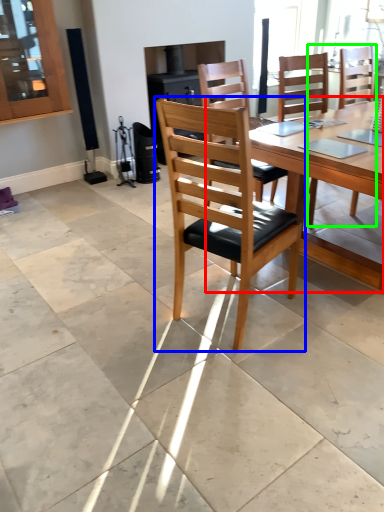
Question: Which object is positioned closest to round table (highlighted by a red box)? Select from chair (highlighted by a blue box) and chair (highlighted by a green box).

Choices:
 (A) chair
 (B) chair

Answer: (A)